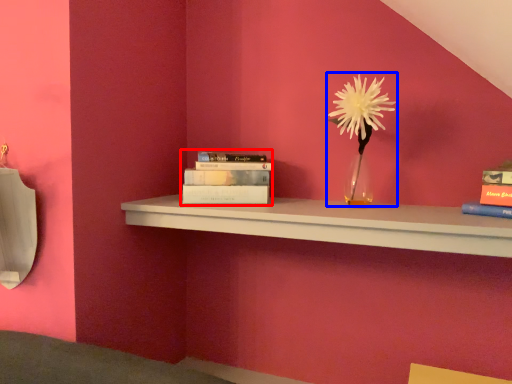
Question: Which object appears closest to the camera in this image, book (highlighted by a red box) or floral arrangement (highlighted by a blue box)?

Choices:
 (A) book
 (B) floral arrangement

Answer: (B)